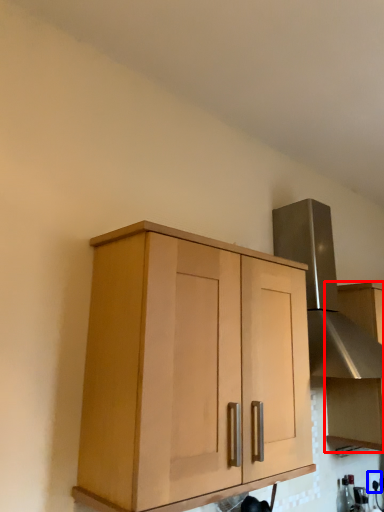
Question: Which point is further to the camera, cabinetry (highlighted by a red box) or electric outlet (highlighted by a blue box)?

Choices:
 (A) cabinetry
 (B) electric outlet

Answer: (B)